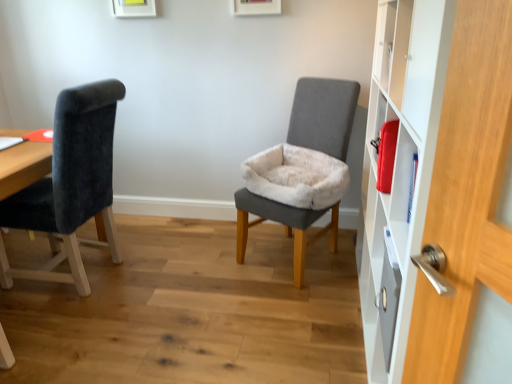
Question: In the image, is white matte cabinet at right positioned in front of or behind gray fabric chair at center, which is the 1th chair from right to left?

Choices:
 (A) front
 (B) behind

Answer: (A)

Question: Would you say white matte cabinet at right is to the left or to the right of gray fabric chair at center, which is the 2th chair from left to right, in the picture?

Choices:
 (A) right
 (B) left

Answer: (A)

Question: Which is nearer to the gray fabric chair at center, which is the 1th chair from right to left?

Choices:
 (A) white matte cabinet at right
 (B) velvet black chair at left, which is the 2th chair in right-to-left order

Answer: (A)

Question: Which object is positioned closest to the velvet black chair at left, which is the 2th chair in right-to-left order?

Choices:
 (A) white matte cabinet at right
 (B) gray fabric chair at center, which is the 2th chair from left to right

Answer: (B)